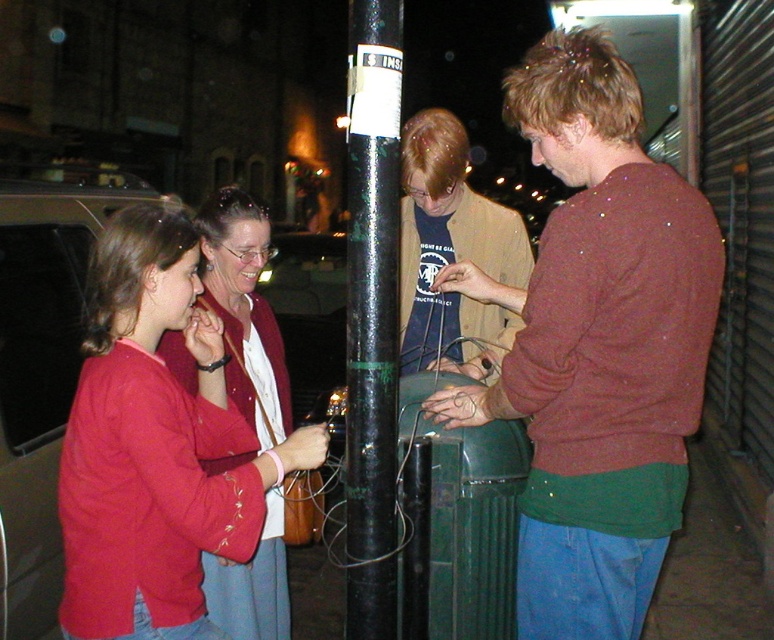
Question: Is maroon sweater at center bigger than black glossy pole at center?

Choices:
 (A) yes
 (B) no

Answer: (A)

Question: Which is nearer to the maroon sweater at center?

Choices:
 (A) black glossy pole at center
 (B) matte red sweater at left

Answer: (A)

Question: Which point is closer to the camera?

Choices:
 (A) black glossy pole at center
 (B) matte red sweater at left

Answer: (A)

Question: Does black glossy pole at center appear on the right side of matte red sweater at left?

Choices:
 (A) yes
 (B) no

Answer: (A)

Question: Does black glossy pole at center have a larger size compared to matte red sweater at left?

Choices:
 (A) no
 (B) yes

Answer: (A)

Question: Which point is farther from the camera taking this photo?

Choices:
 (A) (374, 304)
 (B) (235, 189)
 (C) (611, 317)

Answer: (B)